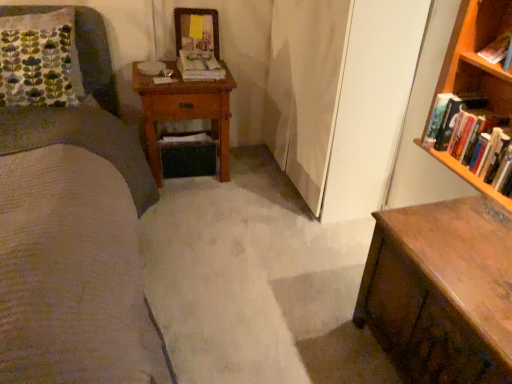
Describe the element at coordinates (442, 291) in the screenshot. I see `wooden chest of drawers at lower right` at that location.

Find the location of `hardcover books at right, the 3th book viewed from the top`. hardcover books at right, the 3th book viewed from the top is located at coordinates (467, 133).

Find the location of a particular element. The width and height of the screenshot is (512, 384). wooden picture frame at upper center is located at coordinates (200, 29).

Which is in front, point (445, 264) or point (213, 93)?

The point (445, 264) is in front.

There is a wooden chest of drawers at lower right. In order to click on nightstand above it (from a real-world perspective) in this screenshot , I will do `click(185, 111)`.

From the image's perspective, between wooden chest of drawers at lower right and wooden nightstand at center, which one is located above?

From the image's view, wooden nightstand at center is above.

Which object is wider, wooden chest of drawers at lower right or wooden nightstand at center?

Wider between the two is wooden chest of drawers at lower right.

From a real-world perspective, is wooden picture frame at upper center physically above wooden nightstand at center?

Correct, in the physical world, wooden picture frame at upper center is higher than wooden nightstand at center.

Is wooden nightstand at center inside wooden picture frame at upper center?

No, wooden nightstand at center is located outside of wooden picture frame at upper center.

Does wooden picture frame at upper center have a lesser width compared to wooden nightstand at center?

Yes, wooden picture frame at upper center is thinner than wooden nightstand at center.

Looking at this image, is wooden picture frame at upper center far away from wooden nightstand at center?

wooden picture frame at upper center is near wooden nightstand at center, not far away.

How different are the orientations of hardcover book at upper right, positioned as the second book in bottom-to-top order, and white paper book at center, marked as the 1th book in a left-to-right arrangement, in degrees?

There is a 86.6-degree angle between the facing directions of hardcover book at upper right, positioned as the second book in bottom-to-top order, and white paper book at center, marked as the 1th book in a left-to-right arrangement.

From the image's perspective, is hardcover book at upper right, arranged as the 2th book when viewed from the back, beneath white paper book at center, the third book when ordered from right to left?

Indeed, from the image's perspective, hardcover book at upper right, arranged as the 2th book when viewed from the back, is shown beneath white paper book at center, the third book when ordered from right to left.

Is hardcover book at upper right, which is counted as the 2th book, starting from the left, surrounding white paper book at center, acting as the 3th book starting from the front?

No, hardcover book at upper right, which is counted as the 2th book, starting from the left, does not contain white paper book at center, acting as the 3th book starting from the front.

This screenshot has width=512, height=384. What are the coordinates of `book that is the 3rd one when counting forward from the wooden picture frame at upper center` in the screenshot? It's located at (467, 133).

Is hardcover books at right, which is the 3th book in back-to-front order, next to wooden picture frame at upper center?

No, hardcover books at right, which is the 3th book in back-to-front order, is not in contact with wooden picture frame at upper center.

Does point (471, 111) lie behind point (213, 46)?

No, it is in front of (213, 46).

Which object is more forward, hardcover books at right, the 1th book in the front-to-back sequence, or wooden picture frame at upper center?

Positioned in front is hardcover books at right, the 1th book in the front-to-back sequence.

Between wooden nightstand at center and white paper book at center, which is the first book from back to front, which one is positioned behind?

white paper book at center, which is the first book from back to front, is more distant.

Is wooden nightstand at center aimed at white paper book at center, the third book when ordered from right to left?

No, wooden nightstand at center is not turned towards white paper book at center, the third book when ordered from right to left.

Are wooden nightstand at center and white paper book at center, acting as the 3th book starting from the front, located far from each other?

wooden nightstand at center is actually quite close to white paper book at center, acting as the 3th book starting from the front.

How far apart are wooden chest of drawers at lower right and hardcover books at right, the 3th book viewed from the top?

wooden chest of drawers at lower right is 17.82 inches away from hardcover books at right, the 3th book viewed from the top.

Is wooden chest of drawers at lower right to the right of hardcover books at right, the 1th book in the front-to-back sequence, from the viewer's perspective?

No, wooden chest of drawers at lower right is not to the right of hardcover books at right, the 1th book in the front-to-back sequence.

Consider the image. Is wooden chest of drawers at lower right looking in the opposite direction of hardcover books at right, the 1th book in the front-to-back sequence?

wooden chest of drawers at lower right is not turned away from hardcover books at right, the 1th book in the front-to-back sequence.

Is wooden chest of drawers at lower right wider than hardcover books at right, the 1th book in the front-to-back sequence?

Yes, wooden chest of drawers at lower right is wider than hardcover books at right, the 1th book in the front-to-back sequence.

Does wooden nightstand at center appear on the left side of wooden chest of drawers at lower right?

Yes.

Considering the relative sizes of wooden nightstand at center and wooden chest of drawers at lower right in the image provided, is wooden nightstand at center taller than wooden chest of drawers at lower right?

Indeed, wooden nightstand at center has a greater height compared to wooden chest of drawers at lower right.

Is wooden nightstand at center turned away from wooden chest of drawers at lower right?

No, wooden chest of drawers at lower right is not at the back of wooden nightstand at center.

Locate an element on the screen. This screenshot has width=512, height=384. nightstand behind the wooden chest of drawers at lower right is located at coordinates (185, 111).

Locate an element on the screen. Image resolution: width=512 pixels, height=384 pixels. picture frame that is above the wooden nightstand at center (from a real-world perspective) is located at coordinates (200, 29).

Considering their positions, is wooden chest of drawers at lower right positioned further to white paper book at center, marked as the 1th book in a left-to-right arrangement, than wooden picture frame at upper center?

wooden chest of drawers at lower right.

Estimate the real-world distances between objects in this image. Which object is closer to white paper book at center, which is the first book from back to front, wooden chest of drawers at lower right or wooden nightstand at center?

wooden nightstand at center is closer to white paper book at center, which is the first book from back to front.

In the scene shown: Based on their spatial positions, is hardcover book at upper right, which is counted as the 2th book, starting from the left, or wooden chest of drawers at lower right closer to wooden picture frame at upper center?

hardcover book at upper right, which is counted as the 2th book, starting from the left, is closer to wooden picture frame at upper center.

Estimate the real-world distances between objects in this image. Which object is further from wooden nightstand at center, white paper book at center, the third book when ordered from right to left, or hardcover book at upper right, arranged as the 2th book when viewed from the back?

hardcover book at upper right, arranged as the 2th book when viewed from the back, is further to wooden nightstand at center.

Based on the photo, based on their spatial positions, is hardcover books at right, which appears as the first book when ordered from the bottom, or hardcover book at upper right, which is counted as the 2th book, starting from the left, further from wooden picture frame at upper center?

hardcover book at upper right, which is counted as the 2th book, starting from the left, is positioned further to the anchor wooden picture frame at upper center.

Looking at the image, which one is located further to white paper book at center, acting as the 3th book starting from the front, hardcover books at right, which appears as the first book when ordered from the bottom, or wooden nightstand at center?

hardcover books at right, which appears as the first book when ordered from the bottom, is positioned further to the anchor white paper book at center, acting as the 3th book starting from the front.

When comparing their distances from wooden chest of drawers at lower right, does white paper book at center, which is the first book from back to front, or wooden nightstand at center seem further?

The object further to wooden chest of drawers at lower right is white paper book at center, which is the first book from back to front.

Which object lies further to the anchor point wooden picture frame at upper center, hardcover books at right, which is the 3th book in back-to-front order, or white paper book at center, which is the first book from back to front?

hardcover books at right, which is the 3th book in back-to-front order.

This screenshot has height=384, width=512. Find the location of `nightstand between wooden chest of drawers at lower right and wooden picture frame at upper center along the z-axis`. nightstand between wooden chest of drawers at lower right and wooden picture frame at upper center along the z-axis is located at coordinates (185, 111).

Image resolution: width=512 pixels, height=384 pixels. I want to click on picture frame between wooden nightstand at center and hardcover book at upper right, which ranks as the 2th book in top-to-bottom order, in the horizontal direction, so click(200, 29).

You are a GUI agent. You are given a task and a screenshot of the screen. Output one action in this format:
    pyautogui.click(x=<x>, y=<y>)
    Task: Click on the chest of drawers between wooden nightstand at center and hardcover book at upper right, arranged as the 2th book when viewed from the back
    Image resolution: width=512 pixels, height=384 pixels.
    Given the screenshot: What is the action you would take?
    pyautogui.click(x=442, y=291)

Image resolution: width=512 pixels, height=384 pixels. Find the location of `chest of drawers between wooden nightstand at center and hardcover books at right, which appears as the first book when ordered from the bottom`. chest of drawers between wooden nightstand at center and hardcover books at right, which appears as the first book when ordered from the bottom is located at coordinates (442, 291).